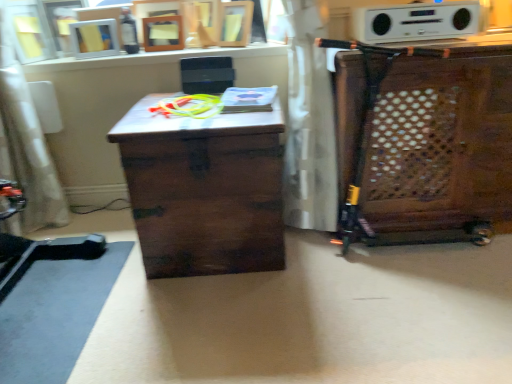
The image size is (512, 384). What are the coordinates of `empty space that is to the right of white matte picture frame at upper left` in the screenshot? It's located at (124, 56).